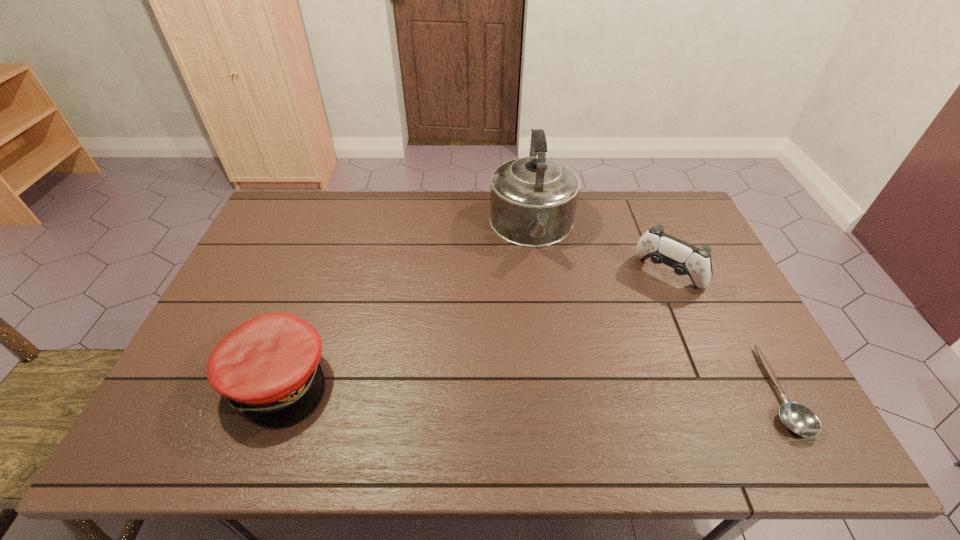
Locate an element on the screen. The height and width of the screenshot is (540, 960). object that is the third closest to the third object from left to right is located at coordinates (268, 367).

Locate an element on the screen. Image resolution: width=960 pixels, height=540 pixels. vacant space that satisfies the following two spatial constraints: 1. on the front side of the second object from right to left; 2. on the right side of the tallest object is located at coordinates (539, 274).